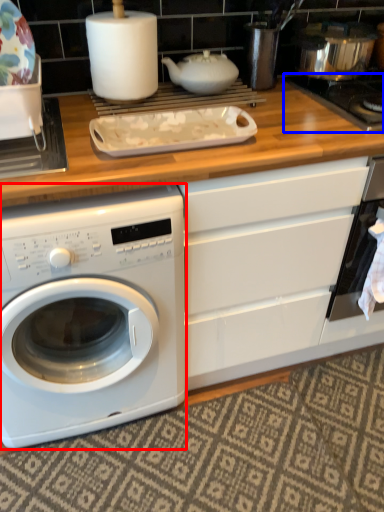
Question: Which object is further to the camera taking this photo, washing machine (highlighted by a red box) or gas stove (highlighted by a blue box)?

Choices:
 (A) washing machine
 (B) gas stove

Answer: (B)